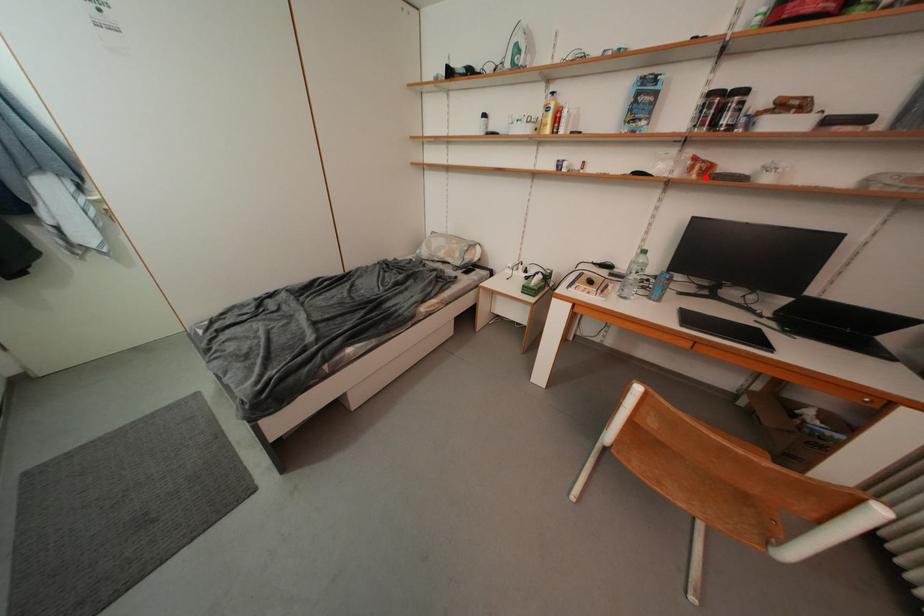
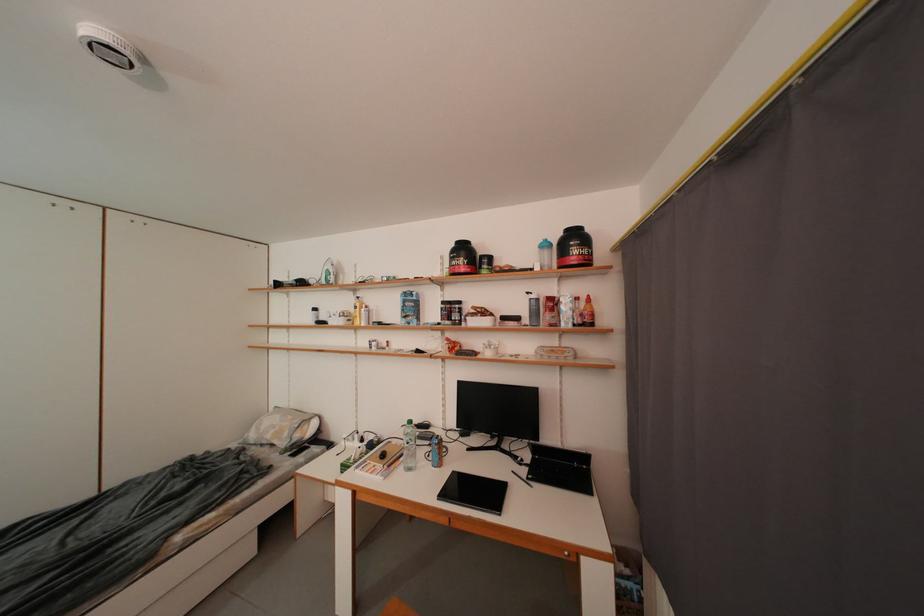
In the second image, find the point that corresponds to the highlighted location in the first image.

(457, 355)